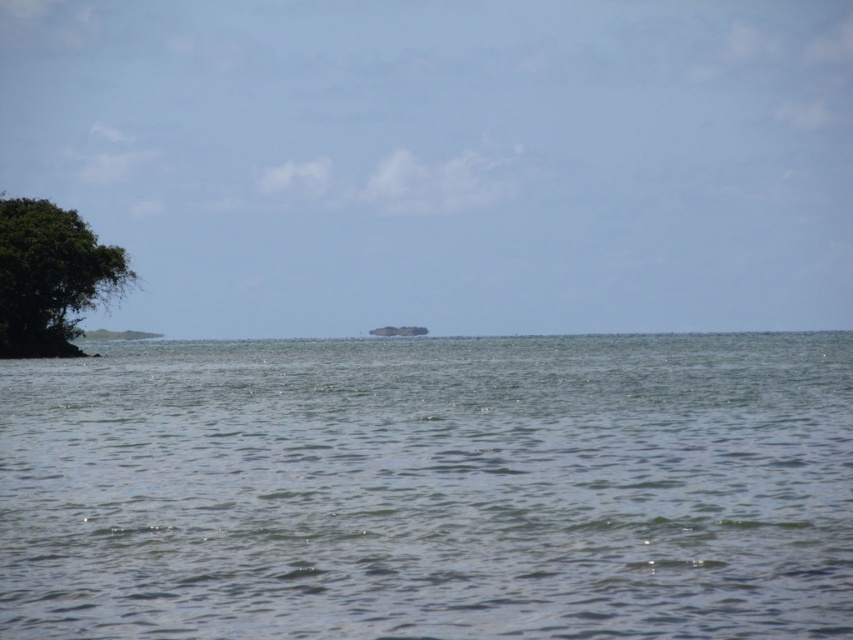
Question: Is green leafy tree at left positioned before green grassy island at center?

Choices:
 (A) yes
 (B) no

Answer: (A)

Question: Is clear water at center to the right of green leafy tree at left from the viewer's perspective?

Choices:
 (A) yes
 (B) no

Answer: (A)

Question: Is clear water at center thinner than green leafy tree at left?

Choices:
 (A) yes
 (B) no

Answer: (B)

Question: Which object appears farthest from the camera in this image?

Choices:
 (A) green grassy island at center
 (B) clear water at center

Answer: (A)

Question: Estimate the real-world distances between objects in this image. Which object is farther from the green leafy tree at left?

Choices:
 (A) clear water at center
 (B) green grassy island at center

Answer: (B)

Question: Which object appears farthest from the camera in this image?

Choices:
 (A) clear water at center
 (B) green grassy island at center

Answer: (B)